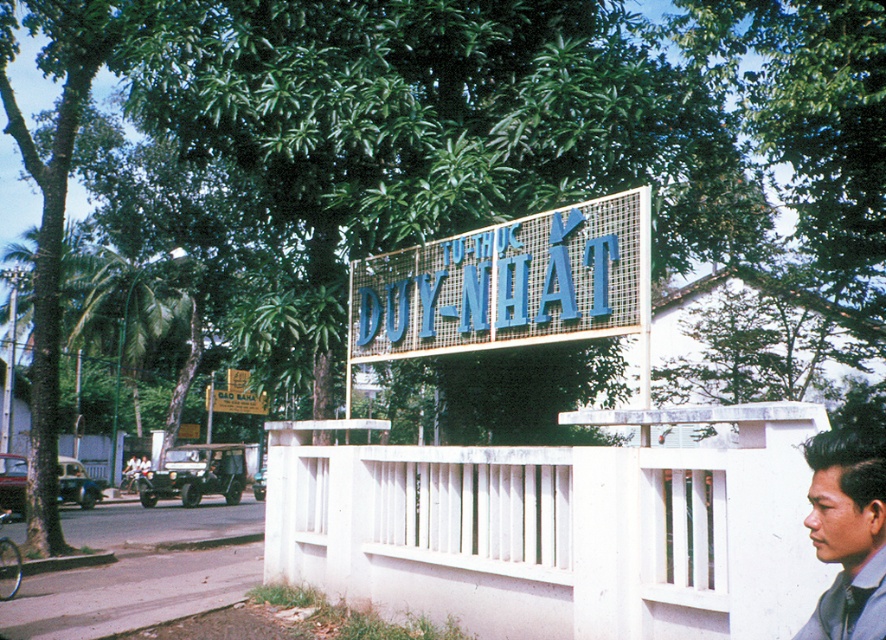
You are a photographer trying to capture the blue metallic sign at center without any obstructions. You notice a person wearing a matte blue shirt at lower right. Based on their positions, will the person be blocking your view of the sign?

The matte blue shirt at lower right is behind the blue metallic sign at center, so the person wearing the matte blue shirt at lower right will not block your view of the sign.

You are standing at the intersection and want to locate the blue metallic sign at center. What are the coordinates where you can find it?

The blue metallic sign at center can be found at coordinates point [507,284].